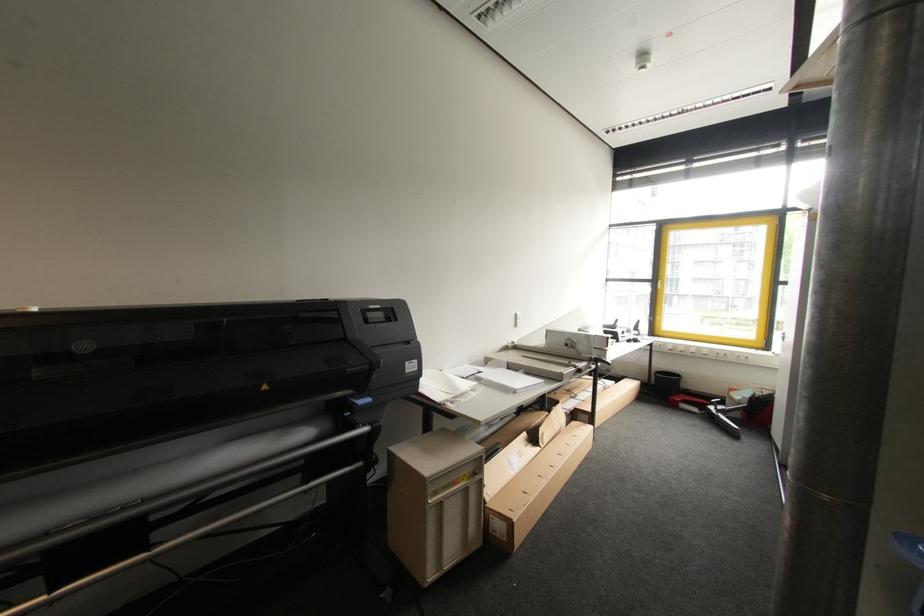
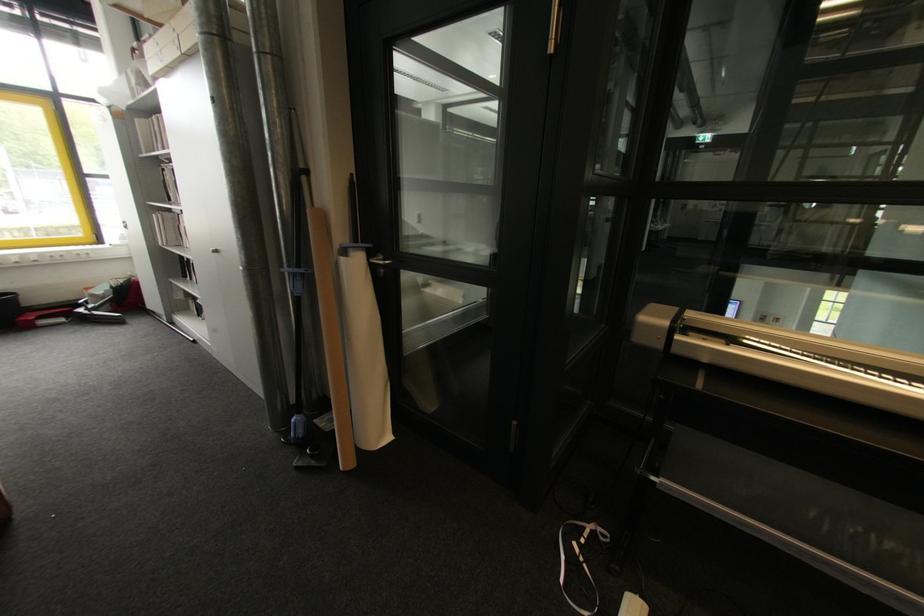
Locate, in the second image, the point that corresponds to pixel 699 411 in the first image.

(66, 321)